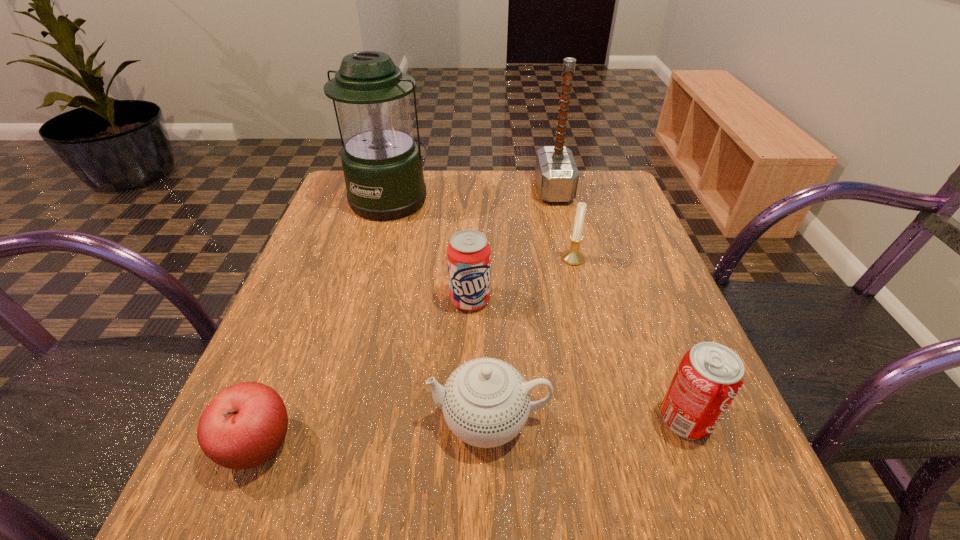
The width and height of the screenshot is (960, 540). What are the coordinates of `free area in between the hammer and the right soda can` in the screenshot? It's located at (620, 304).

Where is `free point between the right soda can and the hammer`? The image size is (960, 540). free point between the right soda can and the hammer is located at coordinates (620, 304).

The height and width of the screenshot is (540, 960). In order to click on free space that is in between the rightmost object and the lantern in this screenshot , I will do `click(538, 308)`.

Locate an element on the screen. unoccupied position between the candle holder and the rightmost object is located at coordinates [629, 339].

Find the location of a particular element. unoccupied area between the apple and the hammer is located at coordinates (407, 318).

The image size is (960, 540). I want to click on unoccupied position between the candle holder and the farther soda can, so click(521, 279).

You are a GUI agent. You are given a task and a screenshot of the screen. Output one action in this format:
    pyautogui.click(x=<x>, y=<y>)
    Task: Click on the free space between the candle holder and the chinaware
    
    Given the screenshot: What is the action you would take?
    pyautogui.click(x=531, y=339)

Image resolution: width=960 pixels, height=540 pixels. I want to click on object that is the closest to the lantern, so click(x=469, y=254).

Locate which object is the closest to the fourth farthest object. Please provide its 2D coordinates. Your answer should be formatted as a tuple, i.e. [(x, y)], where the tuple contains the x and y coordinates of a point satisfying the conditions above.

[(486, 402)]

Image resolution: width=960 pixels, height=540 pixels. Identify the location of blank space that satisfies the following two spatial constraints: 1. on the striking surface of the hammer; 2. on the front side of the apple. (614, 446).